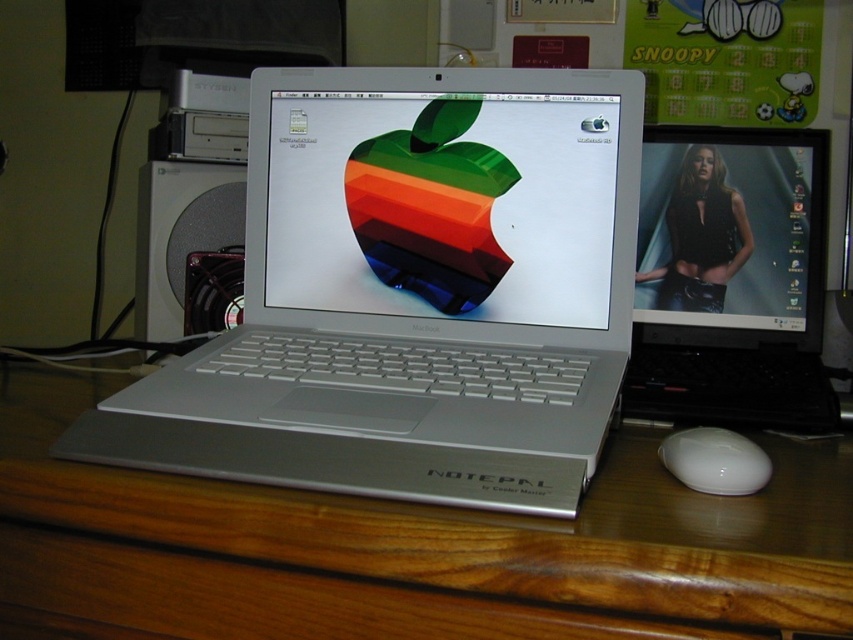
Question: Does silver metallic laptop at center come behind wooden at center?

Choices:
 (A) yes
 (B) no

Answer: (A)

Question: Is silver metallic laptop at center smaller than matte black monitor at upper right?

Choices:
 (A) yes
 (B) no

Answer: (B)

Question: Which of these objects is positioned closest to the silver metallic laptop at center?

Choices:
 (A) wooden at center
 (B) white glossy mouse at lower right
 (C) metallic apple at center

Answer: (C)

Question: Where is wooden at center located in relation to metallic apple at center in the image?

Choices:
 (A) right
 (B) left

Answer: (B)

Question: Which object is closer to the camera taking this photo?

Choices:
 (A) wooden at center
 (B) matte black monitor at upper right
 (C) silver metallic laptop at center

Answer: (A)

Question: Considering the real-world distances, which object is farthest from the matte black monitor at upper right?

Choices:
 (A) wooden at center
 (B) silver metallic laptop at center
 (C) metallic apple at center
 (D) white glossy mouse at lower right

Answer: (D)